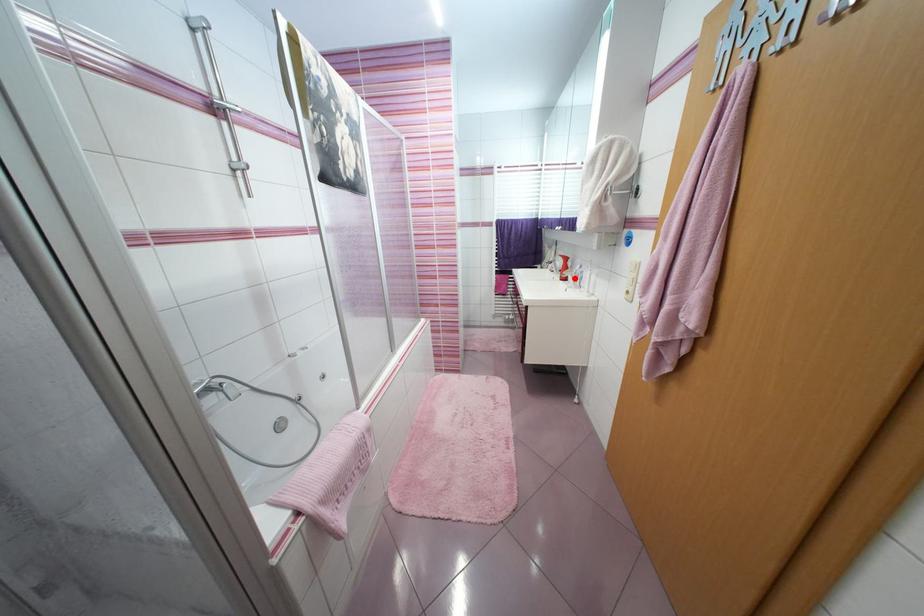
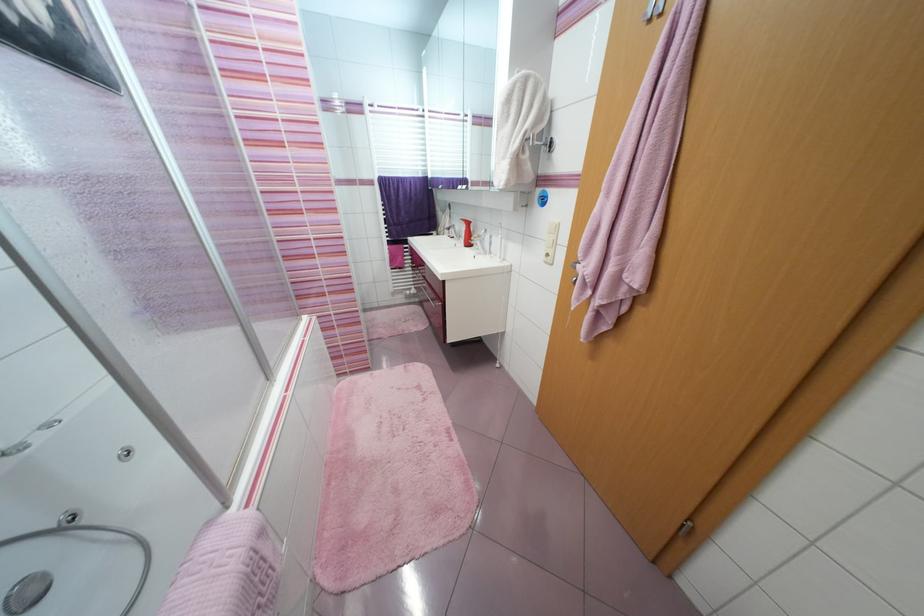
The point at the highlighted location is marked in the first image. Where is the corresponding point in the second image?

(483, 244)